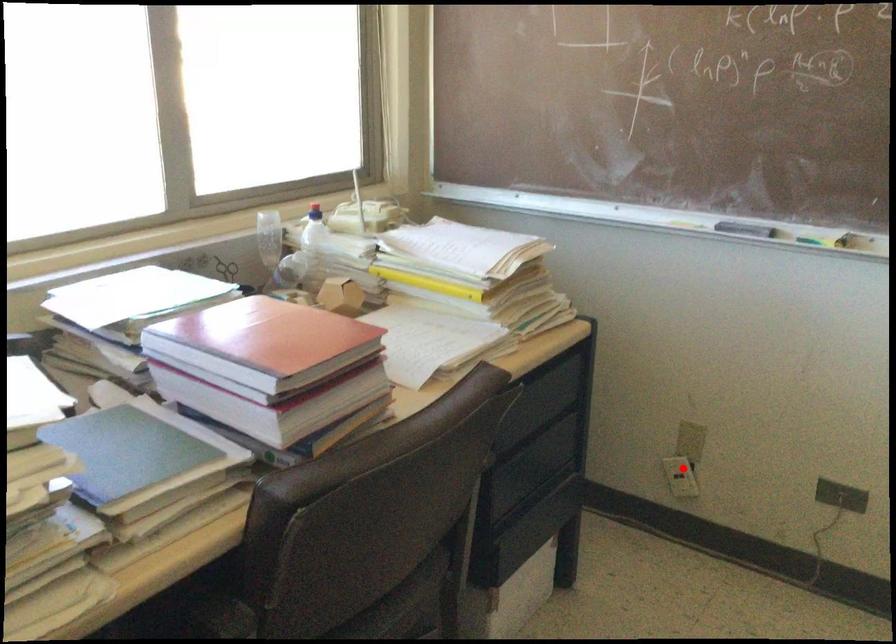
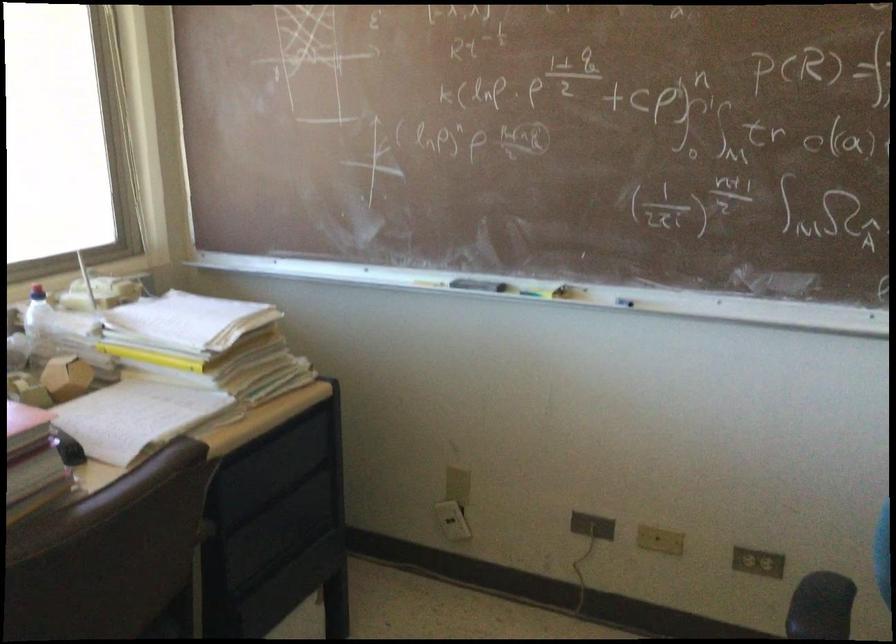
The point at the highlighted location is marked in the first image. Where is the corresponding point in the second image?

(452, 520)